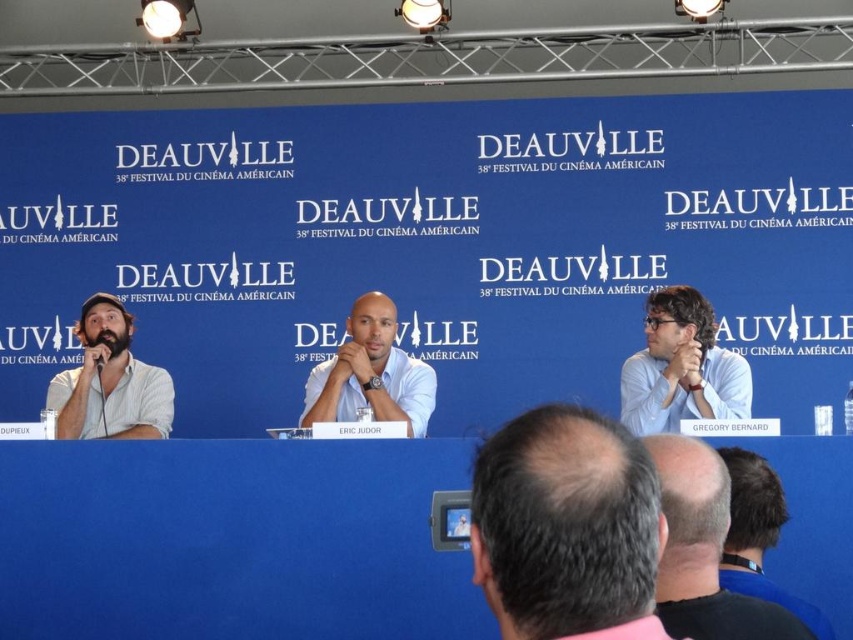
You are a photographer at the event and need to adjust the lighting to ensure both the dark brown hair at lower right and the dark blue shirt at lower right are well lit. Since one is taller than the other, which object should you adjust the light for first to account for their height difference?

The dark brown hair at lower right is taller than the dark blue shirt at lower right, so you should adjust the lighting for the dark brown hair at lower right first to ensure proper illumination given its height.

You are a photographer at the festival and want to take a photo of the panel discussion. The blue backdrop is very reflective and might cause glare. To avoid this, you decide to position yourself so that the bearded man at left and the smooth white shirt at center are between you and the backdrop. Is this possible given their positions?

The bearded man at left is positioned under the smooth white shirt at center, so arranging them between you and the backdrop would not block the reflection effectively since their positions are stacked vertically rather than side by side. Consider repositioning to the side where they form a barrier.